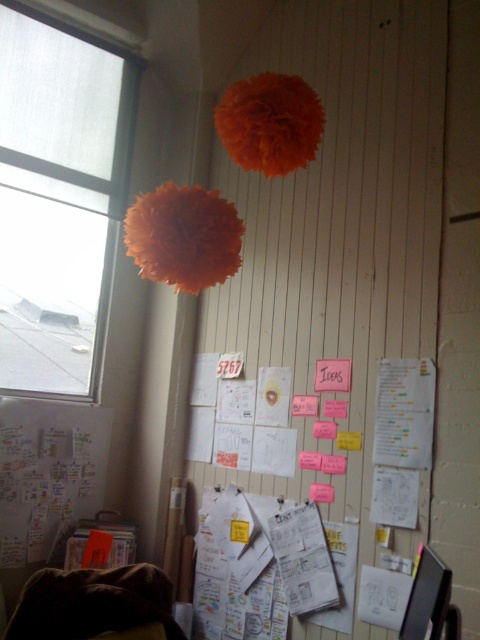
Can you confirm if transparent glass window at upper left is bigger than brown fuzzy blanket at lower left?

Yes.

Does transparent glass window at upper left have a lesser height compared to brown fuzzy blanket at lower left?

In fact, transparent glass window at upper left may be taller than brown fuzzy blanket at lower left.

Who is more forward, (98, 208) or (27, 621)?

Point (27, 621) is more forward.

Where is `transparent glass window at upper left`? Image resolution: width=480 pixels, height=640 pixels. transparent glass window at upper left is located at coordinates pyautogui.click(x=59, y=196).

Who is more distant from viewer, (x=36, y=60) or (x=49, y=484)?

Point (x=36, y=60)

Which of these two, transparent glass window at upper left or white paper at lower left, stands shorter?

white paper at lower left

Find the location of a particular element. transparent glass window at upper left is located at coordinates [x=59, y=196].

Can you confirm if white paper at lower left is taller than brown fuzzy blanket at lower left?

Correct, white paper at lower left is much taller as brown fuzzy blanket at lower left.

Does white paper at lower left have a smaller size compared to brown fuzzy blanket at lower left?

No.

Identify the location of white paper at lower left. The image size is (480, 640). (47, 472).